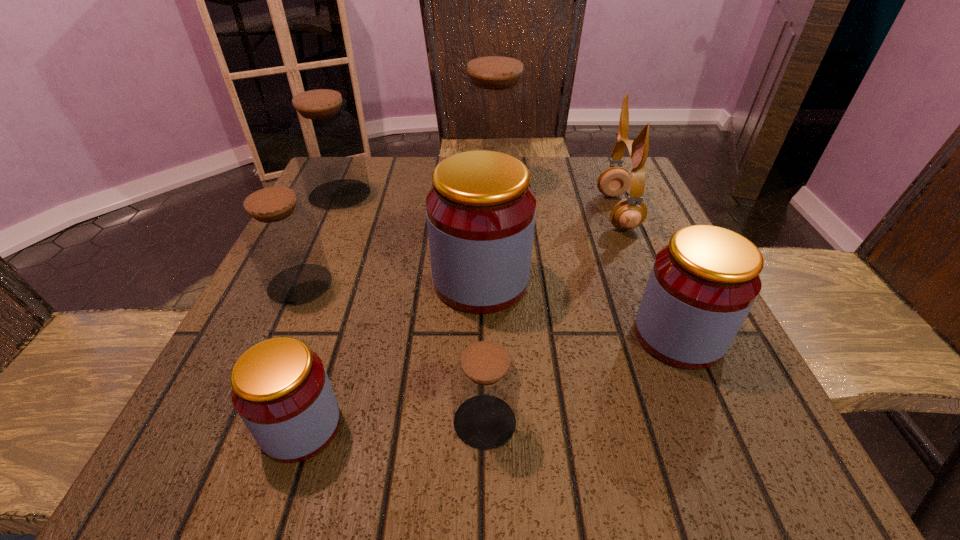
I want to click on free space in the image that satisfies the following two spatial constraints: 1. on the front side of the second red jar from left to right; 2. on the right side of the second biggest brown jar, so pyautogui.click(x=301, y=281).